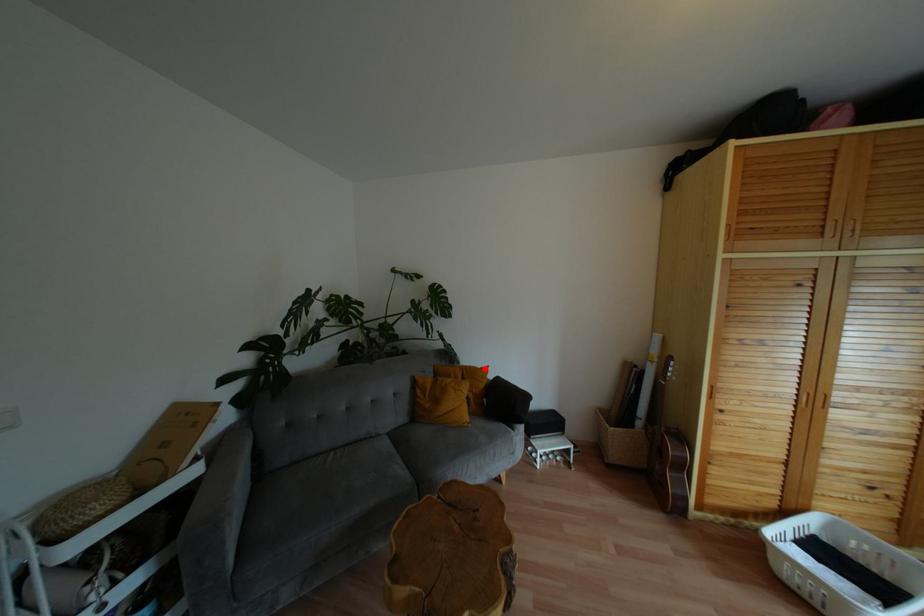
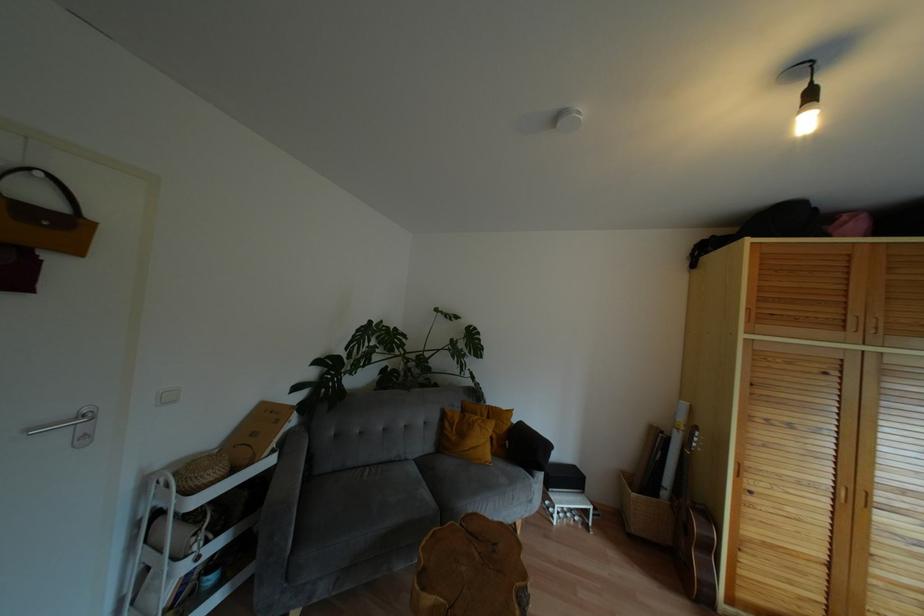
Locate, in the second image, the point that corresponds to the highlighted location in the first image.

(508, 411)